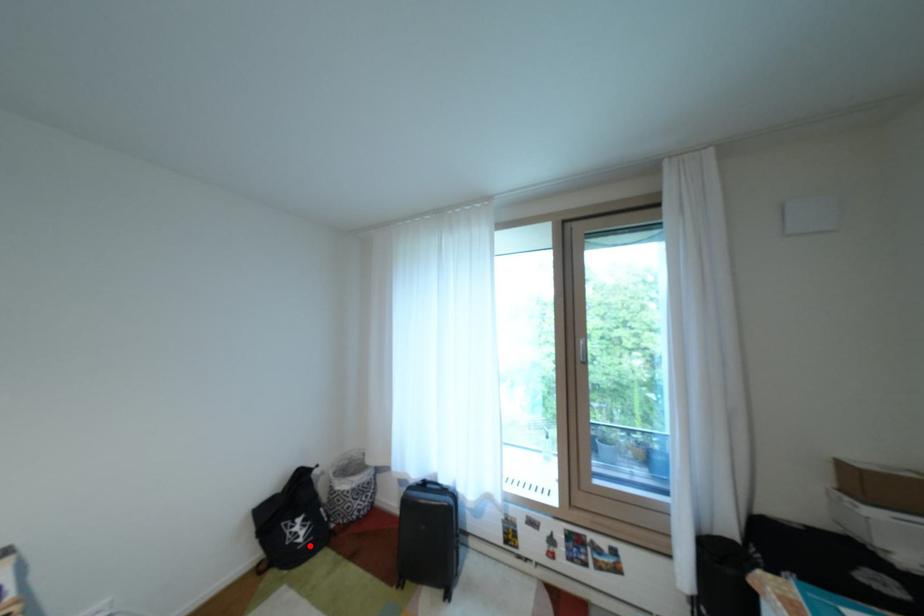
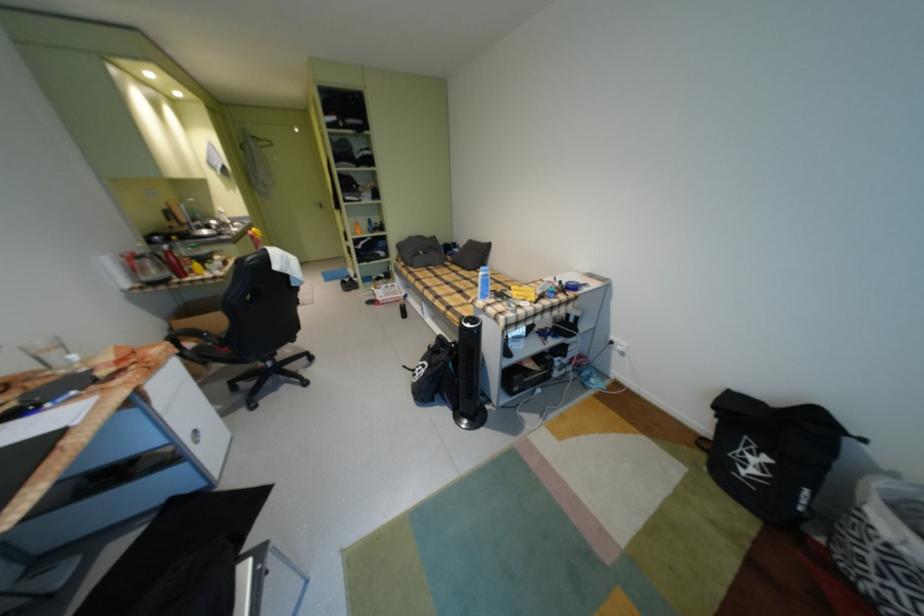
Question: I am providing you with two images of the same scene from different viewpoints. A red point is marked on the first image. At the location where the point appears in image 1, is it still visible in image 2?

Choices:
 (A) Yes
 (B) No

Answer: (A)